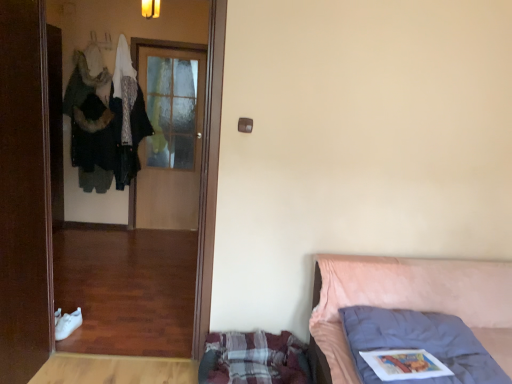
This screenshot has height=384, width=512. In order to click on vacant area on top of wooden door at center, which is counted as the second door, starting from the front (from a real-world perspective) in this screenshot , I will do `click(176, 49)`.